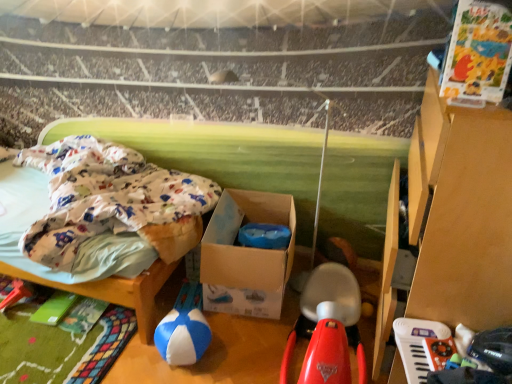
Describe the element at coordinates (460, 213) in the screenshot. I see `brown cardboard drawer at right, which is counted as the first furniture, starting from the right` at that location.

What are the coordinates of `blue/white fabric ball at center, the 1th toy viewed from the left` in the screenshot? It's located at (182, 337).

Locate an element on the screen. cardboard box at center is located at coordinates (246, 255).

Image resolution: width=512 pixels, height=384 pixels. Find the location of `brown cardboard drawer at right, which is counted as the first furniture, starting from the right`. brown cardboard drawer at right, which is counted as the first furniture, starting from the right is located at coordinates (460, 213).

Is brown cardboard drawer at right, which is counted as the first furniture, starting from the right, turned away from white plastic keyboard at lower right, acting as the 3th toy starting from the left?

That's not correct — brown cardboard drawer at right, which is counted as the first furniture, starting from the right, is not looking away from white plastic keyboard at lower right, acting as the 3th toy starting from the left.

Is the surface of brown cardboard drawer at right, which appears as the second furniture when viewed from the left, in direct contact with white plastic keyboard at lower right, placed as the first toy when sorted from right to left?

No.

From the image's perspective, is brown cardboard drawer at right, which is counted as the first furniture, starting from the right, above or below white plastic keyboard at lower right, acting as the 3th toy starting from the left?

Clearly, from the image's perspective, brown cardboard drawer at right, which is counted as the first furniture, starting from the right, is above white plastic keyboard at lower right, acting as the 3th toy starting from the left.

In the scene shown: Between brown cardboard drawer at right, which appears as the second furniture when viewed from the left, and white plastic keyboard at lower right, placed as the first toy when sorted from right to left, which one has larger size?

brown cardboard drawer at right, which appears as the second furniture when viewed from the left.

Considering the relative sizes of cardboard box at center and blue/white fabric ball at center, the 1th toy viewed from the left, in the image provided, is cardboard box at center shorter than blue/white fabric ball at center, the 1th toy viewed from the left,?

In fact, cardboard box at center may be taller than blue/white fabric ball at center, the 1th toy viewed from the left.

Can you confirm if cardboard box at center is thinner than blue/white fabric ball at center, the 1th toy viewed from the left?

No.

Which is more to the left, cardboard box at center or blue/white fabric ball at center, the 1th toy viewed from the left?

Positioned to the left is blue/white fabric ball at center, the 1th toy viewed from the left.

Which of these two, cardboard box at center or blue/white fabric ball at center, positioned as the 3th toy in right-to-left order, is smaller?

blue/white fabric ball at center, positioned as the 3th toy in right-to-left order.

Considering the positions of objects blue/white fabric ball at center, positioned as the 3th toy in right-to-left order, and rubberized red scooter at center, marked as the 2th toy in a right-to-left arrangement, in the image provided, who is more to the left, blue/white fabric ball at center, positioned as the 3th toy in right-to-left order, or rubberized red scooter at center, marked as the 2th toy in a right-to-left arrangement,?

From the viewer's perspective, blue/white fabric ball at center, positioned as the 3th toy in right-to-left order, appears more on the left side.

Considering the relative sizes of blue/white fabric ball at center, the 1th toy viewed from the left, and rubberized red scooter at center, the 2th toy when ordered from left to right, in the image provided, is blue/white fabric ball at center, the 1th toy viewed from the left, wider than rubberized red scooter at center, the 2th toy when ordered from left to right,?

No.

From a real-world perspective, relative to rubberized red scooter at center, the 2th toy when ordered from left to right, is blue/white fabric ball at center, the 1th toy viewed from the left, vertically above or below?

blue/white fabric ball at center, the 1th toy viewed from the left, is below rubberized red scooter at center, the 2th toy when ordered from left to right.

Does point (445, 334) come farther from viewer compared to point (470, 173)?

Yes, point (445, 334) is farther from viewer.

From the image's perspective, is white plastic keyboard at lower right, placed as the first toy when sorted from right to left, located beneath brown cardboard drawer at right, which is counted as the first furniture, starting from the right?

Yes, from the image's perspective, white plastic keyboard at lower right, placed as the first toy when sorted from right to left, is beneath brown cardboard drawer at right, which is counted as the first furniture, starting from the right.

Which object is further away from the camera, white plastic keyboard at lower right, placed as the first toy when sorted from right to left, or brown cardboard drawer at right, which is counted as the first furniture, starting from the right?

white plastic keyboard at lower right, placed as the first toy when sorted from right to left, is further away from the camera.

Looking at this image, from a real-world perspective, which is physically below, white plastic keyboard at lower right, acting as the 3th toy starting from the left, or brown cardboard drawer at right, which appears as the second furniture when viewed from the left?

From a 3D spatial view, white plastic keyboard at lower right, acting as the 3th toy starting from the left, is below.

The width and height of the screenshot is (512, 384). In order to click on the 1st furniture above the white plastic keyboard at lower right, acting as the 3th toy starting from the left (from a real-world perspective) in this screenshot , I will do `click(114, 279)`.

Considering the sizes of objects white plastic keyboard at lower right, placed as the first toy when sorted from right to left, and white fabric bed at upper left, which appears as the 2th furniture when viewed from the right, in the image provided, who is smaller, white plastic keyboard at lower right, placed as the first toy when sorted from right to left, or white fabric bed at upper left, which appears as the 2th furniture when viewed from the right,?

With smaller size is white plastic keyboard at lower right, placed as the first toy when sorted from right to left.

Considering the sizes of objects white plastic keyboard at lower right, acting as the 3th toy starting from the left, and white fabric bed at upper left, acting as the 1th furniture starting from the left, in the image provided, who is wider, white plastic keyboard at lower right, acting as the 3th toy starting from the left, or white fabric bed at upper left, acting as the 1th furniture starting from the left,?

white fabric bed at upper left, acting as the 1th furniture starting from the left.

Is white fabric bed at upper left, which appears as the 2th furniture when viewed from the right, completely or partially inside white plastic keyboard at lower right, placed as the first toy when sorted from right to left?

No, white fabric bed at upper left, which appears as the 2th furniture when viewed from the right, is not a part of white plastic keyboard at lower right, placed as the first toy when sorted from right to left.

Is rubberized red scooter at center, the 2th toy when ordered from left to right, closer to the viewer compared to blue/white fabric ball at center, positioned as the 3th toy in right-to-left order?

Yes, it is.

Based on their sizes in the image, would you say rubberized red scooter at center, marked as the 2th toy in a right-to-left arrangement, is bigger or smaller than blue/white fabric ball at center, positioned as the 3th toy in right-to-left order?

In the image, rubberized red scooter at center, marked as the 2th toy in a right-to-left arrangement, appears to be larger than blue/white fabric ball at center, positioned as the 3th toy in right-to-left order.

Which of these two, rubberized red scooter at center, marked as the 2th toy in a right-to-left arrangement, or blue/white fabric ball at center, positioned as the 3th toy in right-to-left order, is wider?

Wider between the two is rubberized red scooter at center, marked as the 2th toy in a right-to-left arrangement.

From a real-world perspective, is blue/white fabric ball at center, the 1th toy viewed from the left, physically located above or below white plastic keyboard at lower right, acting as the 3th toy starting from the left?

blue/white fabric ball at center, the 1th toy viewed from the left, is situated lower than white plastic keyboard at lower right, acting as the 3th toy starting from the left, in the real world.

Is white plastic keyboard at lower right, placed as the first toy when sorted from right to left, at the back of blue/white fabric ball at center, positioned as the 3th toy in right-to-left order?

No, blue/white fabric ball at center, positioned as the 3th toy in right-to-left order, is not facing away from white plastic keyboard at lower right, placed as the first toy when sorted from right to left.

Considering the positions of points (160, 354) and (416, 319), is point (160, 354) farther from camera compared to point (416, 319)?

Yes, it is behind point (416, 319).

Between blue/white fabric ball at center, positioned as the 3th toy in right-to-left order, and white plastic keyboard at lower right, placed as the first toy when sorted from right to left, which one has smaller size?

Smaller between the two is white plastic keyboard at lower right, placed as the first toy when sorted from right to left.

From a real-world perspective, starting from the brown cardboard drawer at right, which is counted as the first furniture, starting from the right, which toy is the 1st one below it? Please provide its 2D coordinates.

[(417, 332)]

The image size is (512, 384). What are the coordinates of `toy on the left side of cardboard box at center` in the screenshot? It's located at (182, 337).

Looking at the image, which one is located further to white plastic keyboard at lower right, acting as the 3th toy starting from the left, rubberized red scooter at center, marked as the 2th toy in a right-to-left arrangement, or brown cardboard drawer at right, which is counted as the first furniture, starting from the right?

rubberized red scooter at center, marked as the 2th toy in a right-to-left arrangement, lies further to white plastic keyboard at lower right, acting as the 3th toy starting from the left, than the other object.

Consider the image. From the image, which object appears to be farther from white plastic keyboard at lower right, acting as the 3th toy starting from the left, blue/white fabric ball at center, positioned as the 3th toy in right-to-left order, or cardboard box at center?

The object further to white plastic keyboard at lower right, acting as the 3th toy starting from the left, is blue/white fabric ball at center, positioned as the 3th toy in right-to-left order.

Considering their positions, is blue/white fabric ball at center, the 1th toy viewed from the left, positioned further to cardboard box at center than rubberized red scooter at center, the 2th toy when ordered from left to right?

Based on the image, blue/white fabric ball at center, the 1th toy viewed from the left, appears to be further to cardboard box at center.

From the picture: Estimate the real-world distances between objects in this image. Which object is further from white plastic keyboard at lower right, placed as the first toy when sorted from right to left, cardboard box at center or rubberized red scooter at center, the 2th toy when ordered from left to right?

cardboard box at center is positioned further to the anchor white plastic keyboard at lower right, placed as the first toy when sorted from right to left.

Based on their spatial positions, is brown cardboard drawer at right, which appears as the second furniture when viewed from the left, or cardboard box at center further from rubberized red scooter at center, marked as the 2th toy in a right-to-left arrangement?

The object further to rubberized red scooter at center, marked as the 2th toy in a right-to-left arrangement, is brown cardboard drawer at right, which appears as the second furniture when viewed from the left.

Based on their spatial positions, is rubberized red scooter at center, marked as the 2th toy in a right-to-left arrangement, or white plastic keyboard at lower right, placed as the first toy when sorted from right to left, further from white fabric bed at upper left, which appears as the 2th furniture when viewed from the right?

white plastic keyboard at lower right, placed as the first toy when sorted from right to left, is positioned further to the anchor white fabric bed at upper left, which appears as the 2th furniture when viewed from the right.

From the picture: Based on their spatial positions, is brown cardboard drawer at right, which appears as the second furniture when viewed from the left, or white fabric bed at upper left, which appears as the 2th furniture when viewed from the right, closer to rubberized red scooter at center, marked as the 2th toy in a right-to-left arrangement?

brown cardboard drawer at right, which appears as the second furniture when viewed from the left, lies closer to rubberized red scooter at center, marked as the 2th toy in a right-to-left arrangement, than the other object.

Considering their positions, is white fabric bed at upper left, which appears as the 2th furniture when viewed from the right, positioned further to rubberized red scooter at center, marked as the 2th toy in a right-to-left arrangement, than cardboard box at center?

white fabric bed at upper left, which appears as the 2th furniture when viewed from the right, is positioned further to the anchor rubberized red scooter at center, marked as the 2th toy in a right-to-left arrangement.

The width and height of the screenshot is (512, 384). Identify the location of cardboard box situated between blue/white fabric ball at center, the 1th toy viewed from the left, and white plastic keyboard at lower right, acting as the 3th toy starting from the left, from left to right. (246, 255).

Identify the location of cardboard box situated between white fabric bed at upper left, acting as the 1th furniture starting from the left, and brown cardboard drawer at right, which is counted as the first furniture, starting from the right, from left to right. tap(246, 255).

I want to click on toy located between blue/white fabric ball at center, positioned as the 3th toy in right-to-left order, and white plastic keyboard at lower right, acting as the 3th toy starting from the left, in the left-right direction, so click(x=328, y=328).

This screenshot has height=384, width=512. What are the coordinates of `cardboard box situated between blue/white fabric ball at center, positioned as the 3th toy in right-to-left order, and brown cardboard drawer at right, which appears as the second furniture when viewed from the left, from left to right` in the screenshot? It's located at (246, 255).